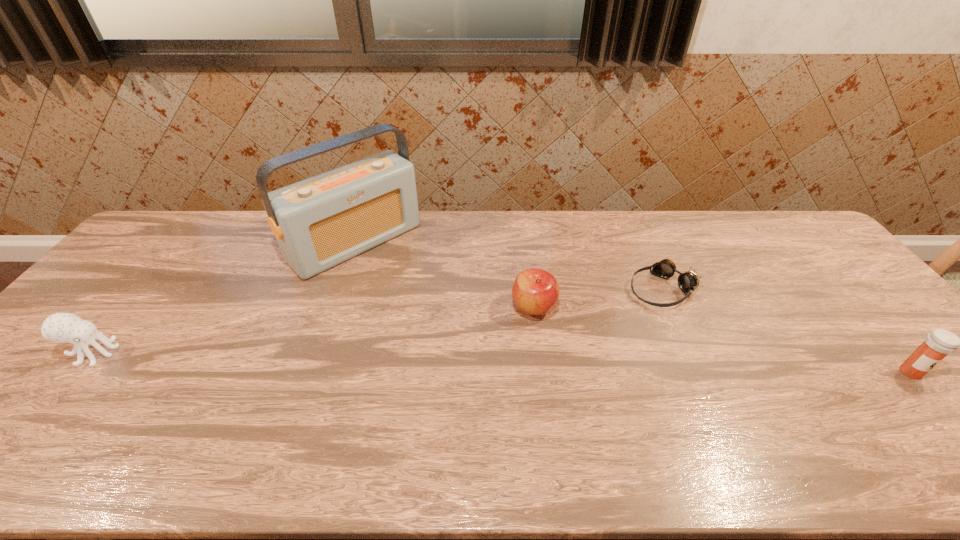
Image resolution: width=960 pixels, height=540 pixels. What are the coordinates of `vacant position located 0.180m on the stem of the third object from right to left` in the screenshot? It's located at (574, 376).

Identify the location of vacant space located 0.050m through the lenses of the shortest object. The image size is (960, 540). (630, 310).

This screenshot has width=960, height=540. I want to click on vacant position located through the lenses of the shortest object, so click(x=570, y=351).

Where is `free spot located through the lenses of the shortest object`? The image size is (960, 540). free spot located through the lenses of the shortest object is located at coordinates (578, 346).

I want to click on free space located on the front-facing side of the fourth object from right to left, so click(x=445, y=320).

At what (x,y) coordinates should I click in order to perform the action: click on free region located 0.260m on the front-facing side of the fourth object from right to left. Please return your answer as a coordinate pair (x, y). Image resolution: width=960 pixels, height=540 pixels. Looking at the image, I should click on (443, 318).

Identify the location of vacant space situated 0.060m on the front-facing side of the fourth object from right to left. The image size is (960, 540). pyautogui.click(x=401, y=281).

The height and width of the screenshot is (540, 960). I want to click on object that is at the far edge, so click(x=319, y=222).

What are the coordinates of `object that is at the left edge` in the screenshot? It's located at (60, 327).

Where is `object present at the right edge`? object present at the right edge is located at coordinates (939, 343).